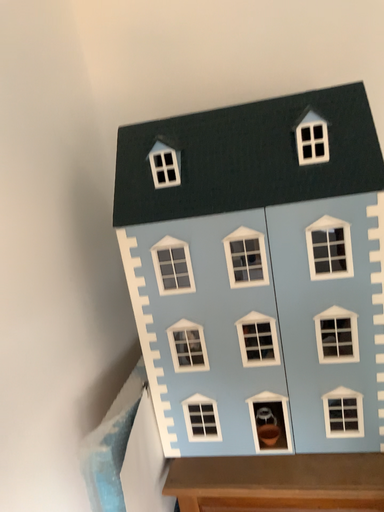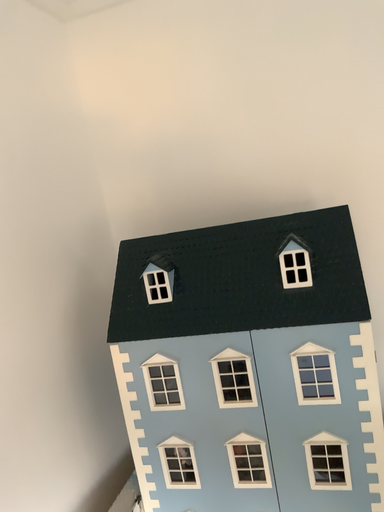
Question: Which way did the camera rotate in the video?

Choices:
 (A) rotated upward
 (B) rotated downward

Answer: (A)